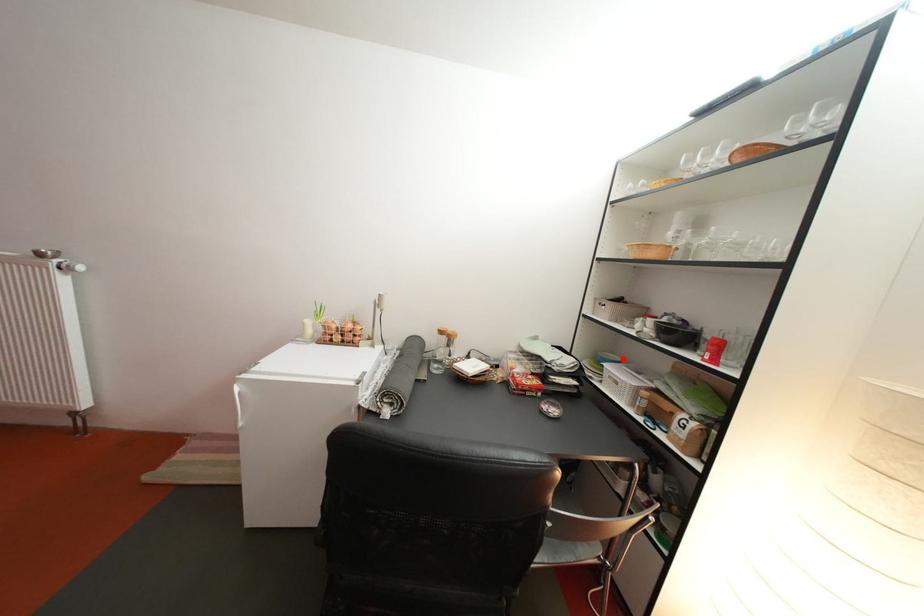
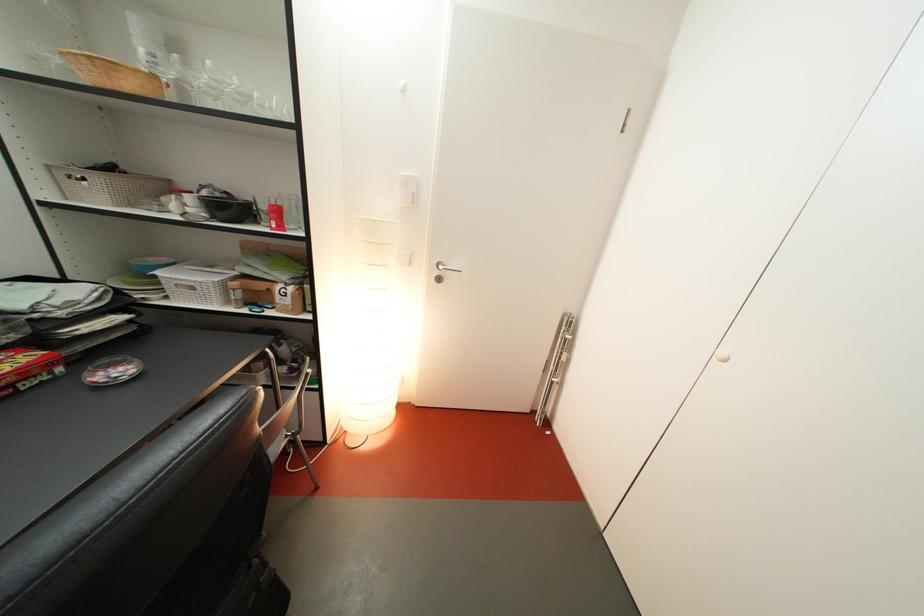
In the second image, find the point that corresponds to the highlighted location in the first image.

(161, 262)